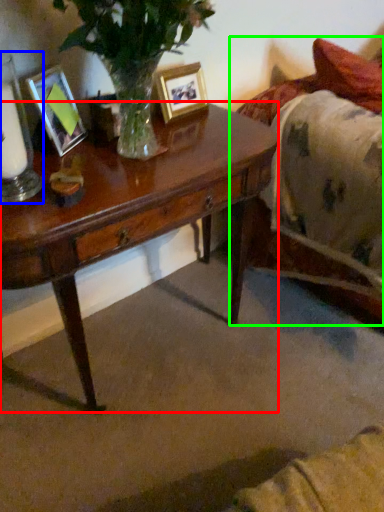
Question: Considering the real-world distances, which object is farthest from desk (highlighted by a red box)? candle holder (highlighted by a blue box) or bed (highlighted by a green box)?

Choices:
 (A) candle holder
 (B) bed

Answer: (B)